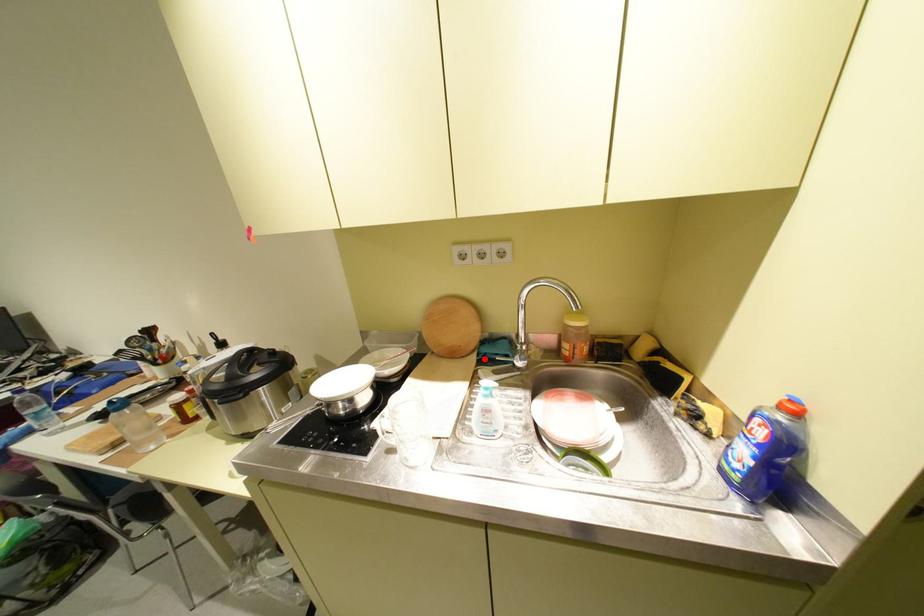
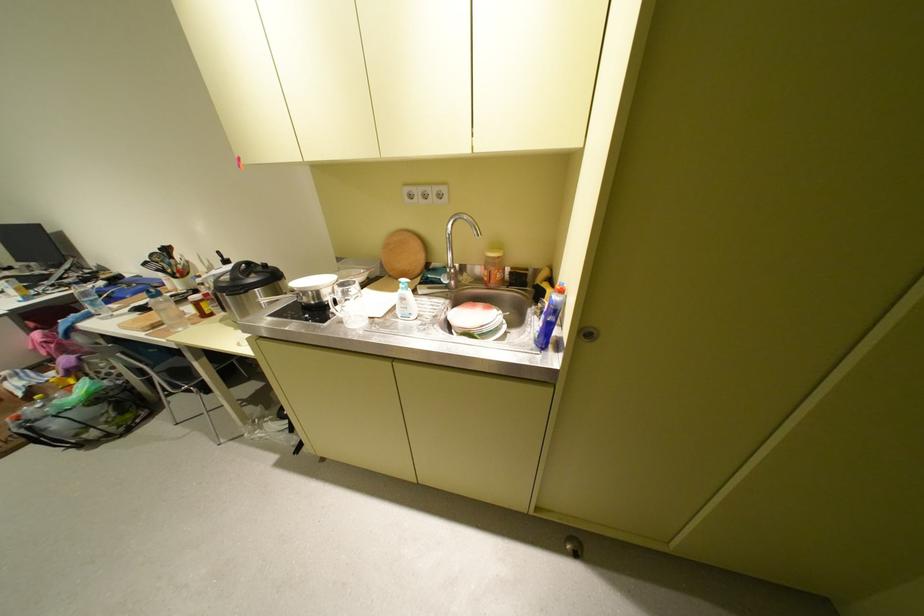
The point at the highlighted location is marked in the first image. Where is the corresponding point in the second image?

(429, 280)